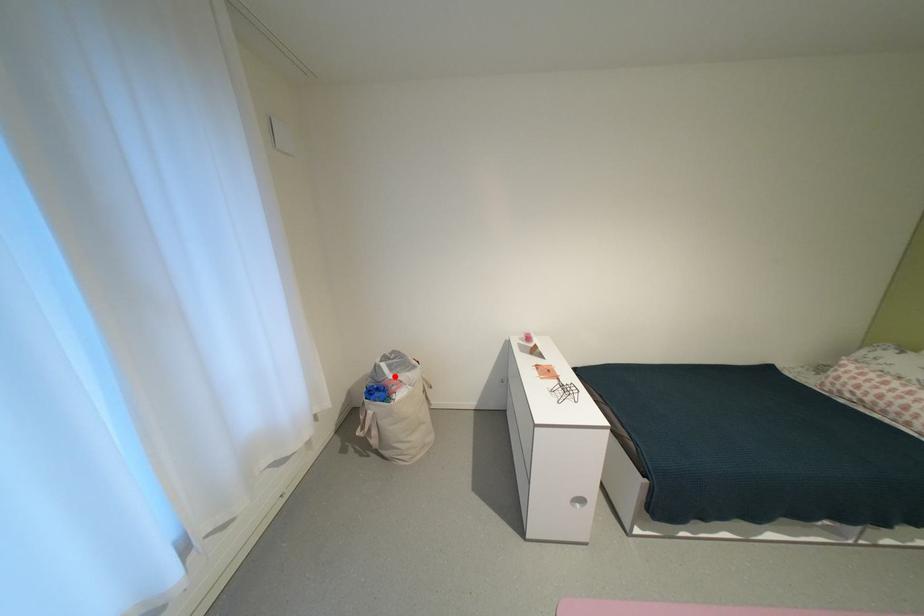
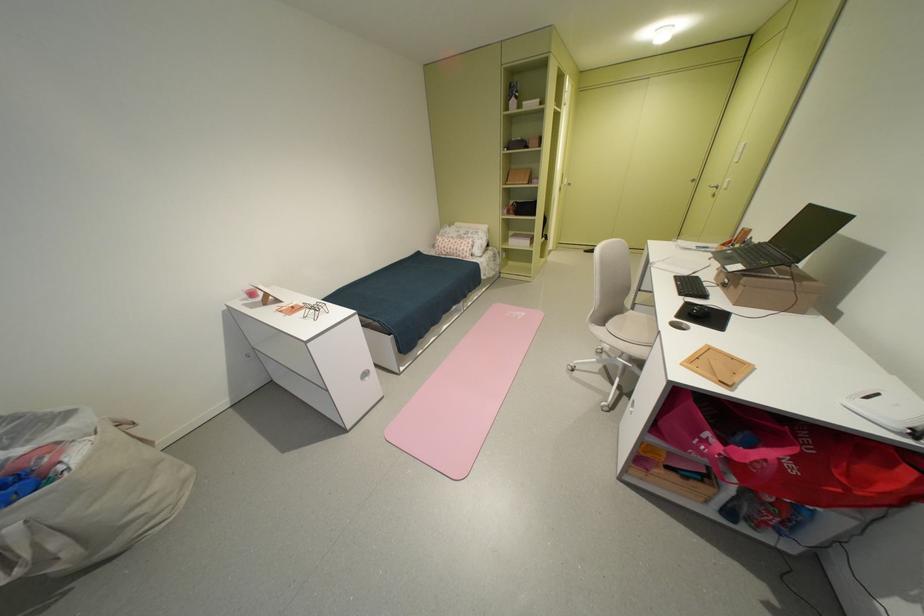
Question: A red point is marked in image1. In image2, is the corresponding 3D point closer to the camera or farther? Reply with the corresponding letter.

Choices:
 (A) The corresponding 3D point is closer.
 (B) The corresponding 3D point is farther.

Answer: (A)